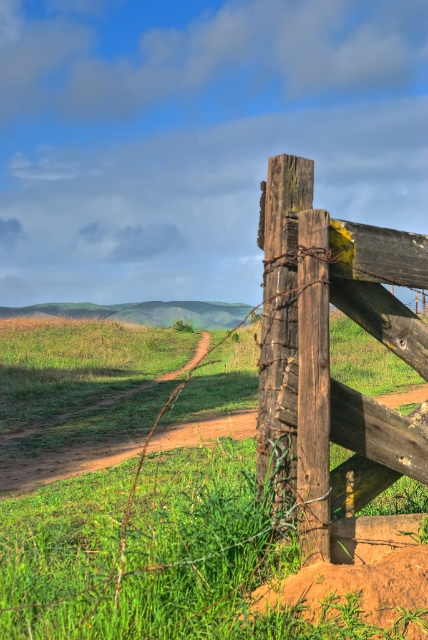
You are standing at the starting point of the dirt path and see the green grassy at center and the weathered wood fence at right. Which object is closer to your left side?

The green grassy at center is to the left of weathered wood fence at right, so the green grassy at center is closer to your left side.

You are standing at the center of the dirt path in the image. The weathered wood fence at right is located at point (327, 344). Which direction should you walk to reach the weathered wood fence at right?

The weathered wood fence at right is located at point (327, 344), which is to the right side of the frame. Since you are standing at the center of the dirt path, you should walk towards the right to reach the weathered wood fence at right.